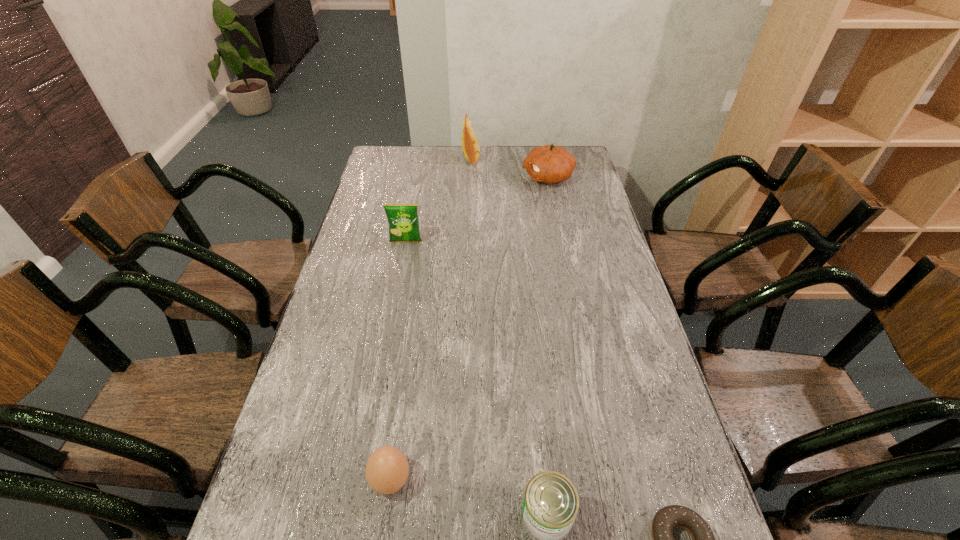
At what (x,y) coordinates should I click in order to perform the action: click on the fourth object from right to left. Please return your answer as a coordinate pair (x, y). The height and width of the screenshot is (540, 960). Looking at the image, I should click on (470, 145).

In order to click on the right crisp (potato chip) in this screenshot , I will do `click(470, 145)`.

Image resolution: width=960 pixels, height=540 pixels. Find the location of `pumpkin`. pumpkin is located at coordinates (550, 164).

This screenshot has height=540, width=960. Find the location of `the left crisp (potato chip)`. the left crisp (potato chip) is located at coordinates (403, 221).

This screenshot has height=540, width=960. What are the coordinates of `the nearer crisp (potato chip)` in the screenshot? It's located at (403, 221).

Locate an element on the screen. This screenshot has width=960, height=540. boiled egg is located at coordinates (387, 469).

Identify the location of free space located on the front-facing side of the farther crisp (potato chip). The width and height of the screenshot is (960, 540). (562, 158).

In order to click on free location located on the front face of the pumpkin in this screenshot , I will do `click(493, 177)`.

Where is `vacant area situated 0.310m on the front face of the pumpkin`? This screenshot has height=540, width=960. vacant area situated 0.310m on the front face of the pumpkin is located at coordinates (447, 177).

This screenshot has width=960, height=540. I want to click on vacant position located on the front face of the pumpkin, so click(428, 177).